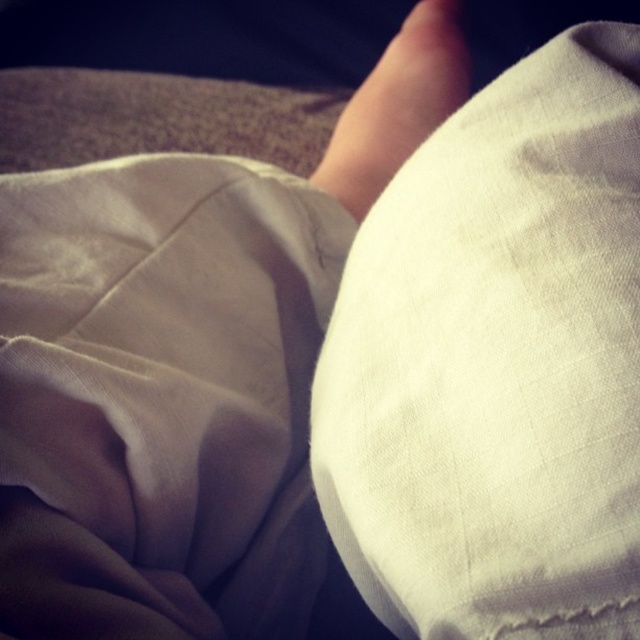
You are a physical therapist instructing a patient to place their lower leg on the white cotton pillow at center. The patient is 6 feet tall and their lower leg is 18 inches long. Can they comfortably place their entire lower leg on the pillow without overhanging?

The distance between the white cotton pillow at center and the viewer is 7.67 inches. Since the patient is 6 feet tall and their lower leg is 18 inches long, the pillow is positioned too far away to accommodate the entire length of the lower leg. The patient would need to adjust their position to ensure the pillow is within reach.

You are a photographer setting up a shoot. You need to place a small prop exactly at the center of the image. However, there is already a white cotton pillow at center. Can you place your prop at the image center without overlapping the pillow?

The white cotton pillow at center is located at point (497, 364). Since the image center is typically at coordinates (320, 320), the pillow is slightly offset to the right and bottom. Therefore, placing the prop at the exact center would not overlap with the pillow.

You are a physical therapist examining a patient. You notice the white cotton pillow at center and the skinny beige foot at center. Based on their positions, which object is closer to the bottom edge of the image?

The white cotton pillow at center is located below the skinny beige foot at center, so it is closer to the bottom edge of the image.